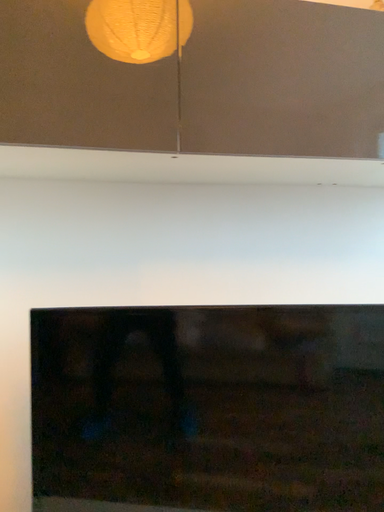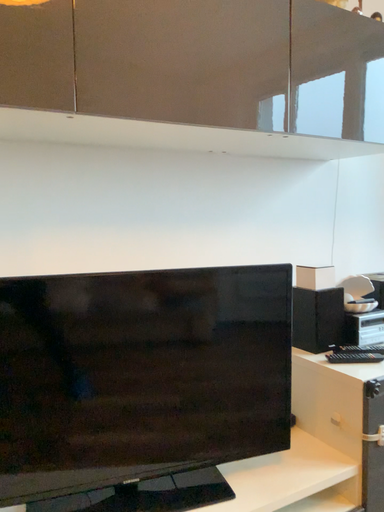
Question: Which way did the camera rotate in the video?

Choices:
 (A) rotated right
 (B) rotated left

Answer: (A)